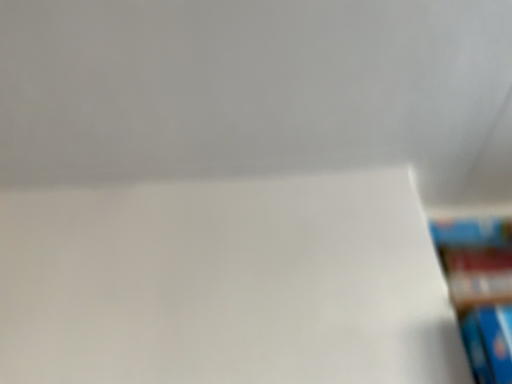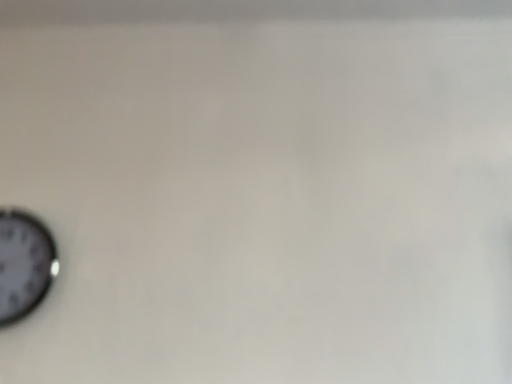
Question: How did the camera likely rotate when shooting the video?

Choices:
 (A) rotated upward
 (B) rotated downward

Answer: (B)